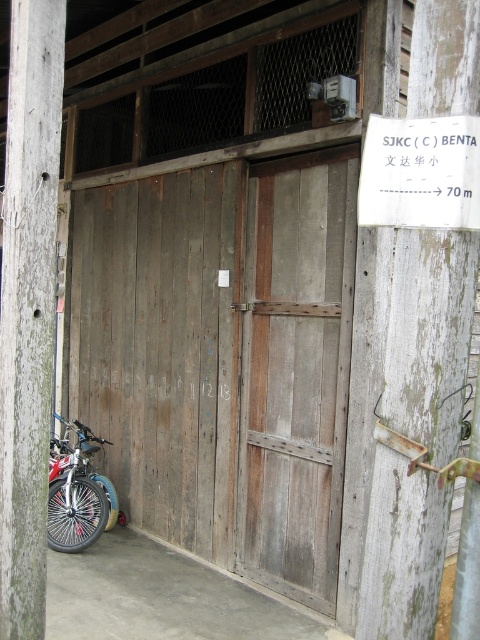
Does weathered wood sign at right appear under weathered wood post at left?

Yes, weathered wood sign at right is below weathered wood post at left.

In the scene shown: Which of these two, weathered wood sign at right or weathered wood post at left, stands shorter?

Standing shorter between the two is weathered wood sign at right.

The image size is (480, 640). Describe the element at coordinates (414, 332) in the screenshot. I see `weathered wood sign at right` at that location.

This screenshot has height=640, width=480. Find the location of `weathered wood sign at right`. weathered wood sign at right is located at coordinates (414, 332).

Does weathered wood garage door at center appear over white paper sign at upper right?

Incorrect, weathered wood garage door at center is not positioned above white paper sign at upper right.

Between point (113, 250) and point (373, 202), which one is positioned in front?

Point (373, 202)

Who is more forward, (272, 420) or (388, 168)?

Positioned in front is point (388, 168).

This screenshot has width=480, height=640. Find the location of `weathered wood garage door at center`. weathered wood garage door at center is located at coordinates (224, 356).

Is weathered wood sign at right shorter than shiny metallic bicycle at lower left?

In fact, weathered wood sign at right may be taller than shiny metallic bicycle at lower left.

Is weathered wood sign at right closer to the viewer compared to shiny metallic bicycle at lower left?

Yes, it is in front of shiny metallic bicycle at lower left.

The width and height of the screenshot is (480, 640). Describe the element at coordinates (414, 332) in the screenshot. I see `weathered wood sign at right` at that location.

Find the location of a particular element. The width and height of the screenshot is (480, 640). weathered wood sign at right is located at coordinates (414, 332).